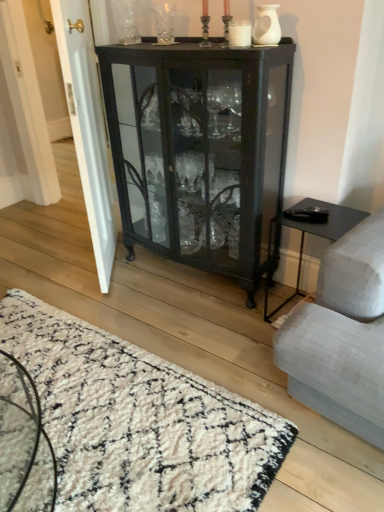
You are a GUI agent. You are given a task and a screenshot of the screen. Output one action in this format:
    pyautogui.click(x=<x>, y=<y>)
    Task: Click on the vacant space situated on the left part of black glass cabinet at center
    The width and height of the screenshot is (384, 512).
    Given the screenshot: What is the action you would take?
    pyautogui.click(x=92, y=282)